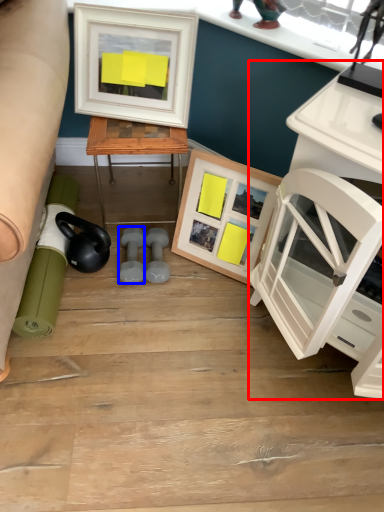
Question: Which object is further to the camera taking this photo, computer desk (highlighted by a red box) or dumbbell (highlighted by a blue box)?

Choices:
 (A) computer desk
 (B) dumbbell

Answer: (B)